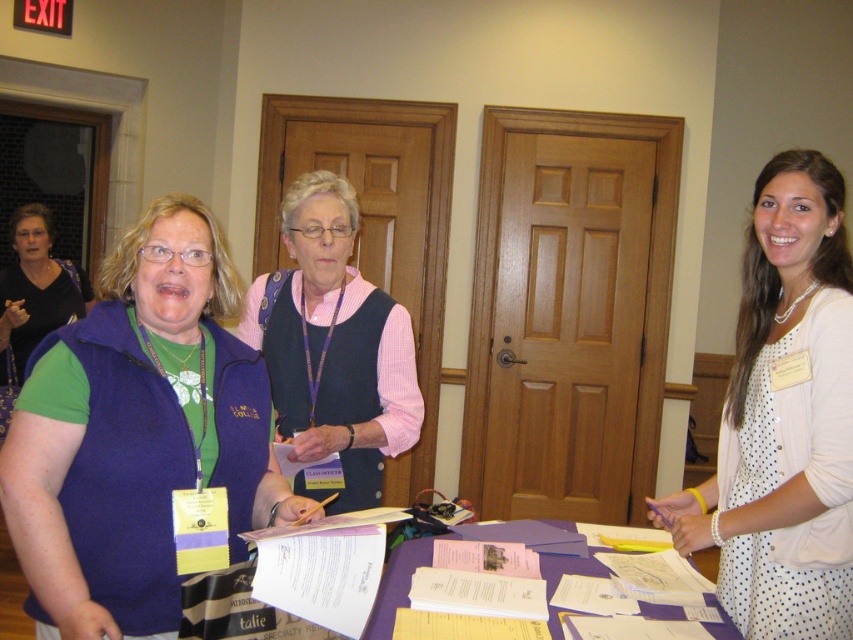
Question: Does matte purple vest at center lie behind matte black sweater at left?

Choices:
 (A) no
 (B) yes

Answer: (A)

Question: Can you confirm if white dotted dress at center is smaller than purple paper at center?

Choices:
 (A) yes
 (B) no

Answer: (B)

Question: Which point appears farthest from the camera in this image?

Choices:
 (A) (258, 438)
 (B) (706, 596)
 (C) (302, 346)

Answer: (C)

Question: Which of the following is the closest to the observer?

Choices:
 (A) (401, 337)
 (B) (27, 252)
 (C) (807, 250)
 (D) (550, 573)

Answer: (C)

Question: Which of these objects is positioned closest to the white dotted dress at center?

Choices:
 (A) pink woven vest at center
 (B) purple paper at center
 (C) matte purple vest at center
 (D) matte black sweater at left

Answer: (B)

Question: Does pink woven vest at center have a smaller size compared to matte black sweater at left?

Choices:
 (A) yes
 (B) no

Answer: (A)